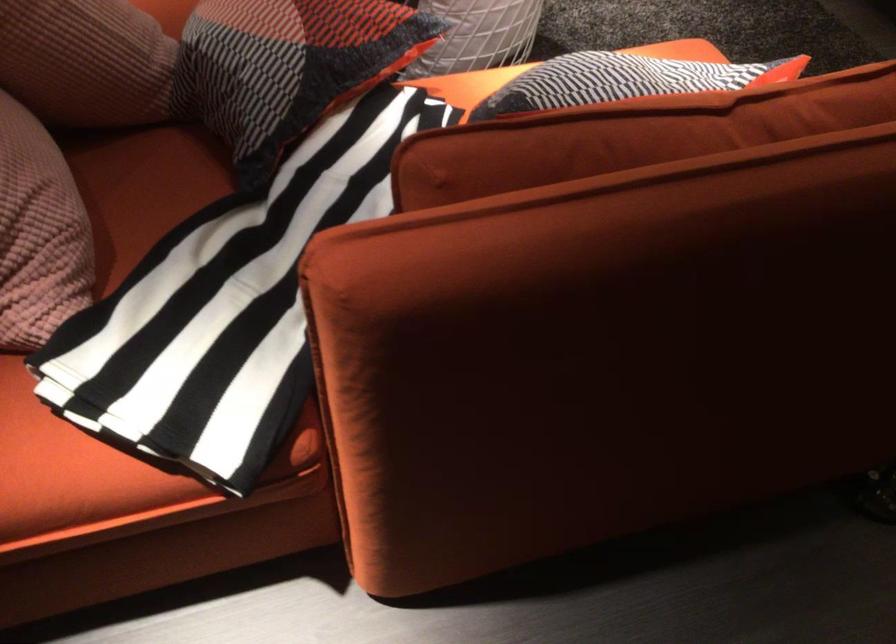
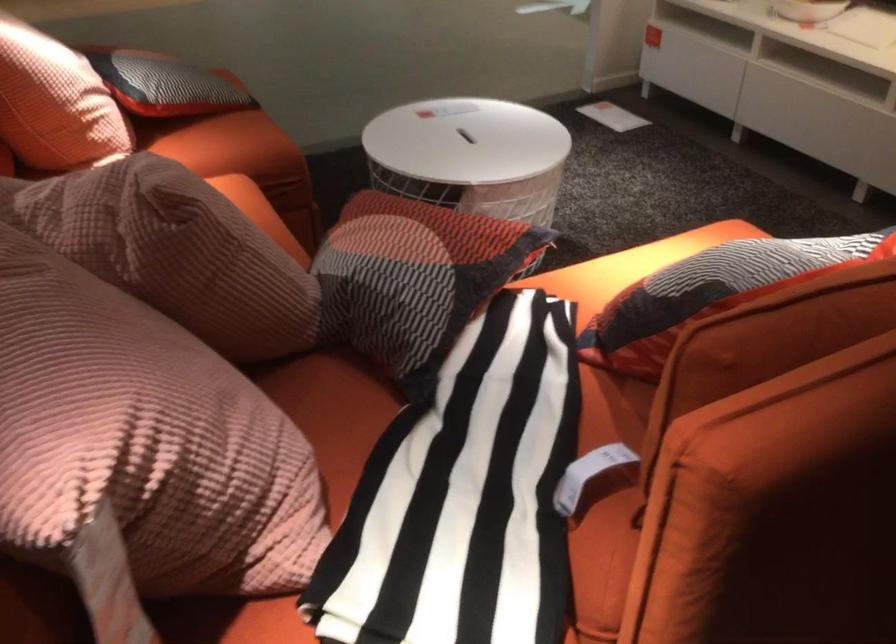
Question: The images are taken continuously from a first-person perspective. In which direction is your viewpoint rotating?

Choices:
 (A) Left
 (B) Right
 (C) Up
 (D) Down

Answer: (C)